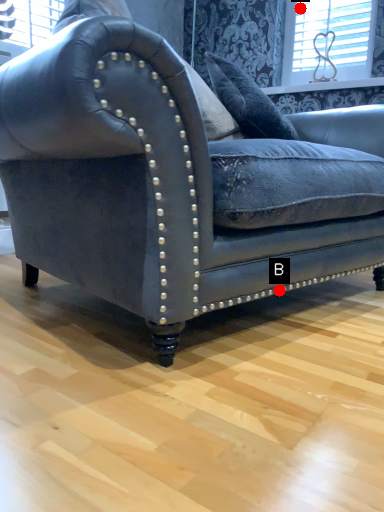
Question: Two points are circled on the image, labeled by A and B beside each circle. Which point is farther to the camera?

Choices:
 (A) A is further
 (B) B is further

Answer: (A)